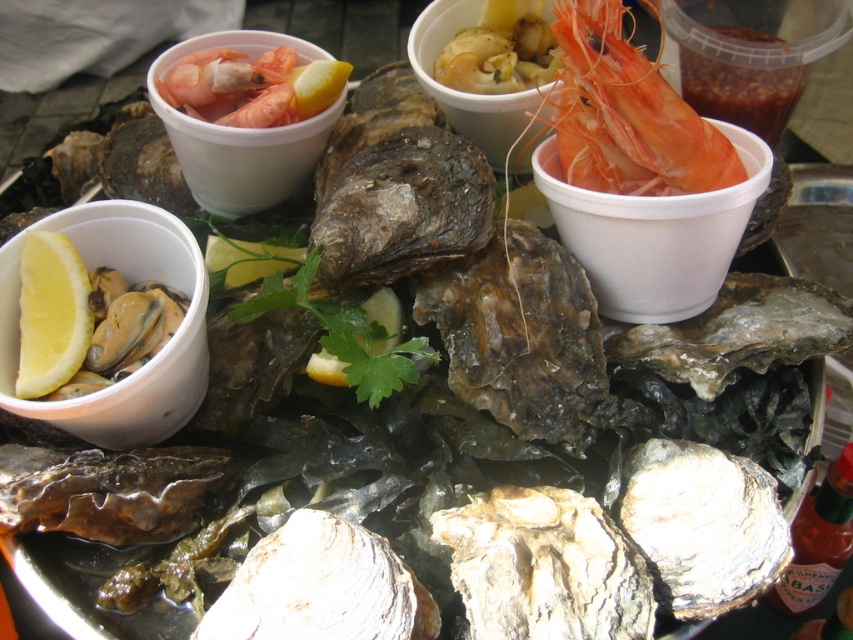
Question: Does shiny orange shrimp at upper right have a greater width compared to shiny pink shrimp at upper left?

Choices:
 (A) no
 (B) yes

Answer: (B)

Question: Does shiny orange shrimp at upper right appear on the right side of shiny pink shrimp at upper left?

Choices:
 (A) yes
 (B) no

Answer: (A)

Question: Which point appears closest to the camera in this image?

Choices:
 (A) (189, 86)
 (B) (621, 13)
 (C) (67, 310)

Answer: (B)

Question: Is yellow matte lemon at lower left to the left of shiny pink shrimp at upper left from the viewer's perspective?

Choices:
 (A) yes
 (B) no

Answer: (A)

Question: Among these objects, which one is farthest from the camera?

Choices:
 (A) shiny pink shrimp at upper left
 (B) shiny orange shrimp at upper right
 (C) yellow matte lemon at lower left

Answer: (A)

Question: Which point is farther from the camera taking this photo?

Choices:
 (A) (158, 84)
 (B) (727, 173)

Answer: (A)